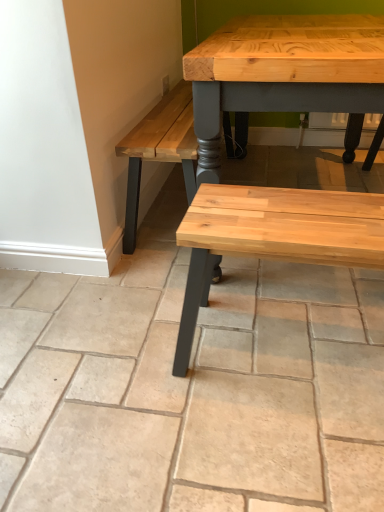
Question: Is natural stone bench at center in front of natural wood bench at center?

Choices:
 (A) no
 (B) yes

Answer: (B)

Question: Can you confirm if natural stone bench at center is bigger than natural wood bench at center?

Choices:
 (A) yes
 (B) no

Answer: (A)

Question: Is natural stone bench at center beside natural wood bench at center?

Choices:
 (A) no
 (B) yes

Answer: (A)

Question: From the image's perspective, is natural stone bench at center over natural wood bench at center?

Choices:
 (A) yes
 (B) no

Answer: (A)

Question: From the image's perspective, is natural stone bench at center below natural wood bench at center?

Choices:
 (A) no
 (B) yes

Answer: (A)

Question: Considering the relative positions of natural stone bench at center and natural wood bench at center in the image provided, is natural stone bench at center behind natural wood bench at center?

Choices:
 (A) no
 (B) yes

Answer: (A)

Question: Is natural wood bench at center positioned with its back to natural stone bench at center?

Choices:
 (A) yes
 (B) no

Answer: (A)

Question: Considering the relative sizes of natural wood bench at center and natural stone bench at center in the image provided, is natural wood bench at center taller than natural stone bench at center?

Choices:
 (A) no
 (B) yes

Answer: (B)

Question: From a real-world perspective, does natural wood bench at center stand above natural stone bench at center?

Choices:
 (A) yes
 (B) no

Answer: (A)

Question: From a real-world perspective, is natural wood bench at center below natural stone bench at center?

Choices:
 (A) yes
 (B) no

Answer: (B)

Question: Is natural stone bench at center completely or partially inside natural wood bench at center?

Choices:
 (A) no
 (B) yes

Answer: (A)

Question: Is natural wood bench at center thinner than natural stone bench at center?

Choices:
 (A) yes
 (B) no

Answer: (A)

Question: Is natural wood bench at center taller or shorter than natural stone bench at center?

Choices:
 (A) short
 (B) tall

Answer: (B)